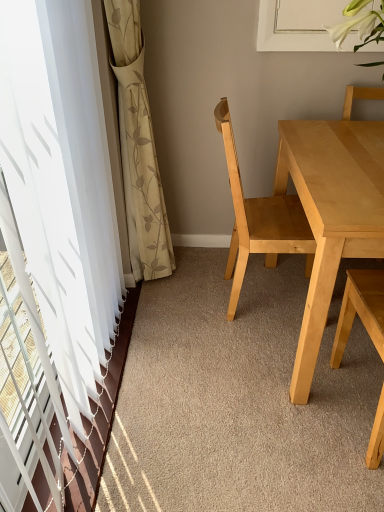
The height and width of the screenshot is (512, 384). Identify the location of vacant area in front of light wood chair at center, the first chair in the left-to-right sequence. (247, 359).